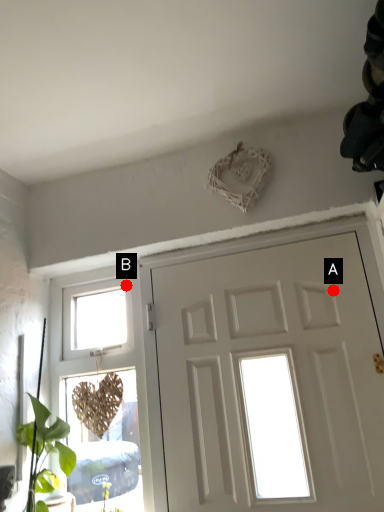
Question: Two points are circled on the image, labeled by A and B beside each circle. Which point is further to the camera?

Choices:
 (A) A is further
 (B) B is further

Answer: (B)